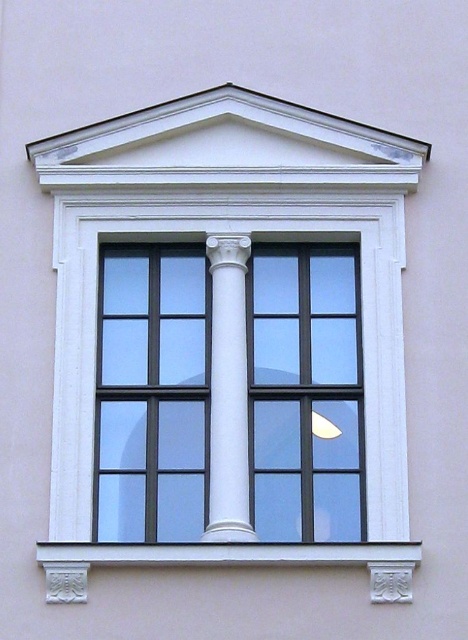
Does clear glass window at center have a smaller size compared to white stone window sill at lower center?

No, clear glass window at center is not smaller than white stone window sill at lower center.

Is clear glass window at center above white stone window sill at lower center?

Indeed, clear glass window at center is positioned over white stone window sill at lower center.

Who is more distant from viewer, (241, 340) or (65, 573)?

Point (241, 340)

Locate an element on the screen. The width and height of the screenshot is (468, 640). clear glass window at center is located at coordinates (229, 394).

Is clear glass window at center taller than white glossy column at center?

Indeed, clear glass window at center has a greater height compared to white glossy column at center.

Is point (210, 372) positioned behind point (228, 433)?

Yes, point (210, 372) is farther from viewer.

Find the location of a particular element. clear glass window at center is located at coordinates (229, 394).

The width and height of the screenshot is (468, 640). Describe the element at coordinates (238, 259) in the screenshot. I see `white glossy window frame at upper center` at that location.

Can you confirm if white glossy window frame at upper center is positioned to the right of white glossy column at center?

In fact, white glossy window frame at upper center is to the left of white glossy column at center.

Between point (160, 228) and point (221, 353), which one is positioned in front?

Point (221, 353) is in front.

Where is `white glossy window frame at upper center`? The width and height of the screenshot is (468, 640). white glossy window frame at upper center is located at coordinates (238, 259).